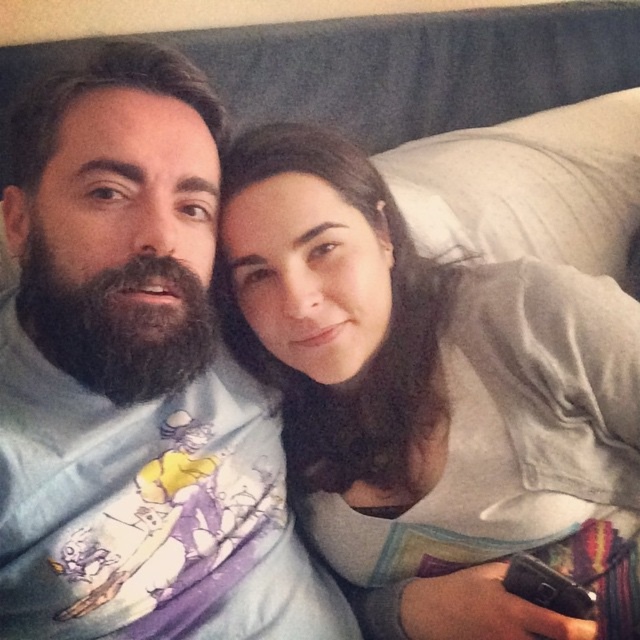
Consider the image. Is smooth gray shirt at center below white soft pillow at upper right?

Indeed, smooth gray shirt at center is positioned under white soft pillow at upper right.

Can you confirm if smooth gray shirt at center is thinner than white soft pillow at upper right?

Correct, smooth gray shirt at center's width is less than white soft pillow at upper right's.

Who is more forward, (436, 404) or (564, 136)?

Point (436, 404)

Identify the location of smooth gray shirt at center. The height and width of the screenshot is (640, 640). (433, 397).

Does light blue cotton shirt at center have a greater height compared to white soft pillow at upper right?

Correct, light blue cotton shirt at center is much taller as white soft pillow at upper right.

Is point (163, 616) positioned after point (529, 179)?

No, it is not.

Locate an element on the screen. The width and height of the screenshot is (640, 640). light blue cotton shirt at center is located at coordinates (134, 381).

Image resolution: width=640 pixels, height=640 pixels. What are the coordinates of `light blue cotton shirt at center` in the screenshot? It's located at (134, 381).

Can you confirm if smooth gray shirt at center is taller than light blue cotton shirt at center?

No, smooth gray shirt at center is not taller than light blue cotton shirt at center.

Does point (605, 371) come behind point (80, 520)?

That is True.

The image size is (640, 640). What are the coordinates of `smooth gray shirt at center` in the screenshot? It's located at (433, 397).